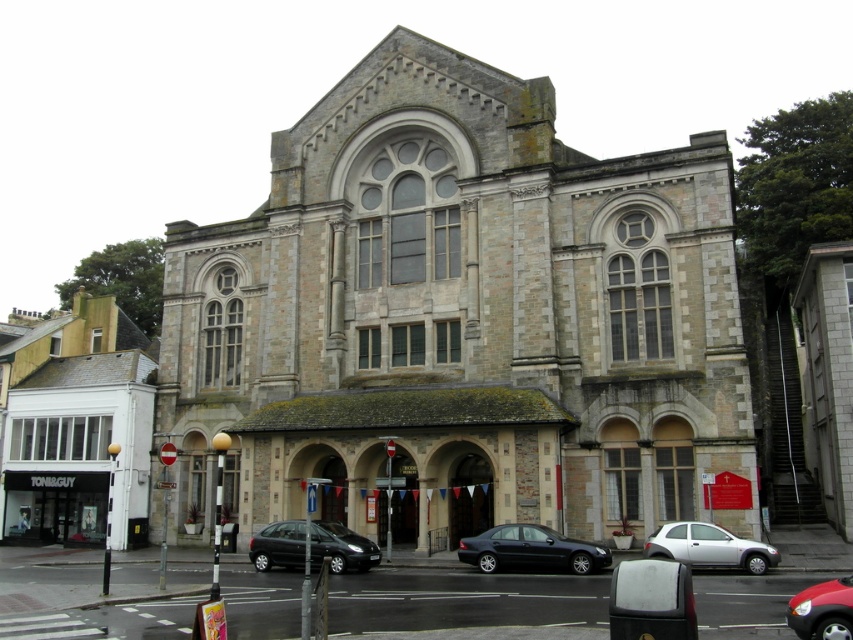
Question: Can you confirm if shiny black sedan at center is thinner than shiny black hatchback at center?

Choices:
 (A) yes
 (B) no

Answer: (A)

Question: Among these points, which one is nearest to the camera?

Choices:
 (A) (820, 592)
 (B) (296, 529)
 (C) (705, 360)
 (D) (521, 525)

Answer: (A)

Question: Is silver metallic hatchback at lower center bigger than shiny red car at lower right?

Choices:
 (A) yes
 (B) no

Answer: (B)

Question: Does shiny black sedan at center come in front of silver metallic hatchback at lower center?

Choices:
 (A) no
 (B) yes

Answer: (A)

Question: Considering the real-world distances, which object is closest to the silver metallic hatchback at lower center?

Choices:
 (A) shiny red car at lower right
 (B) shiny black hatchback at center
 (C) stone church at center
 (D) shiny black sedan at center

Answer: (D)

Question: Which point is farther to the camera?

Choices:
 (A) silver metallic hatchback at lower center
 (B) stone church at center
 (C) shiny black hatchback at center
 (D) shiny red car at lower right

Answer: (B)